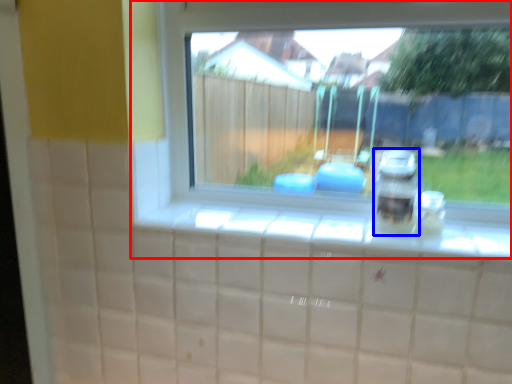
Question: Which object is further to the camera taking this photo, window (highlighted by a red box) or appliance (highlighted by a blue box)?

Choices:
 (A) window
 (B) appliance

Answer: (B)